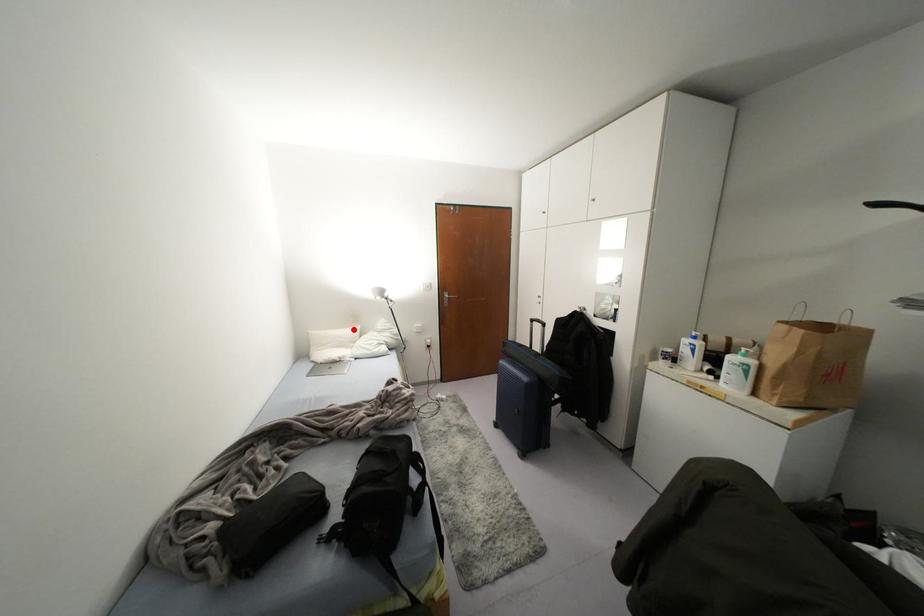
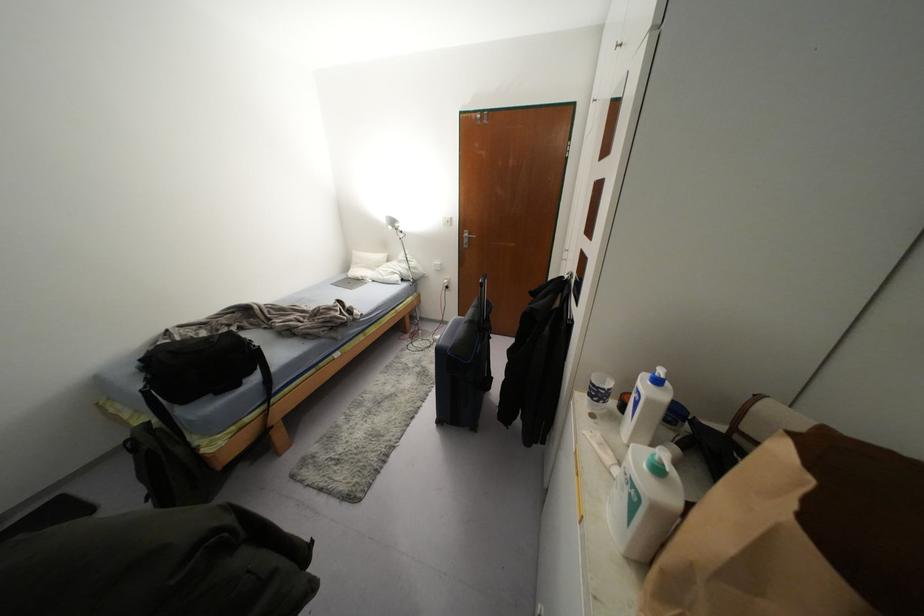
The point at the highlighted location is marked in the first image. Where is the corresponding point in the second image?

(382, 256)